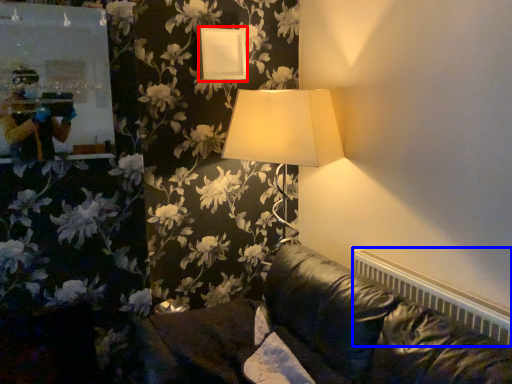
Question: Which object appears farthest to the camera in this image, picture frame (highlighted by a red box) or radiator (highlighted by a blue box)?

Choices:
 (A) picture frame
 (B) radiator

Answer: (A)